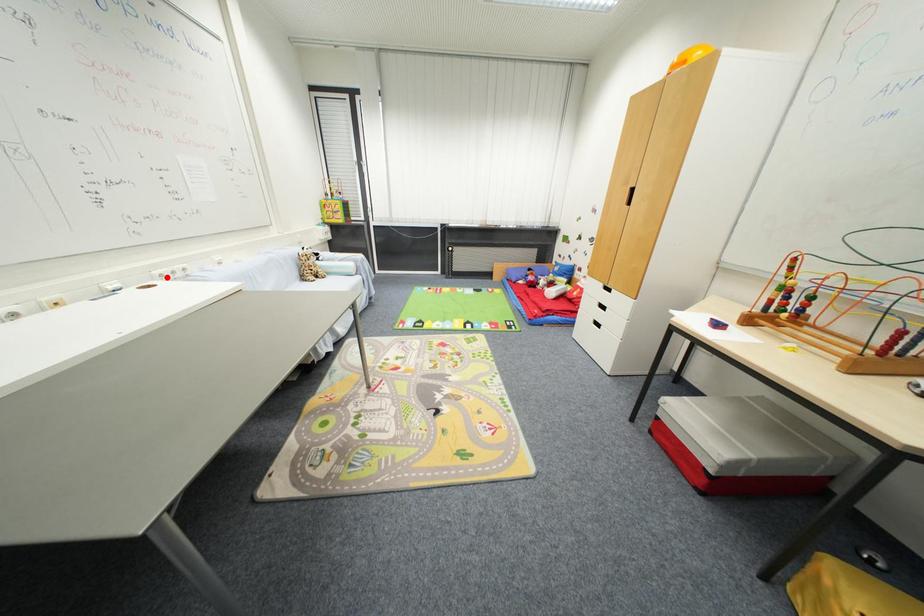
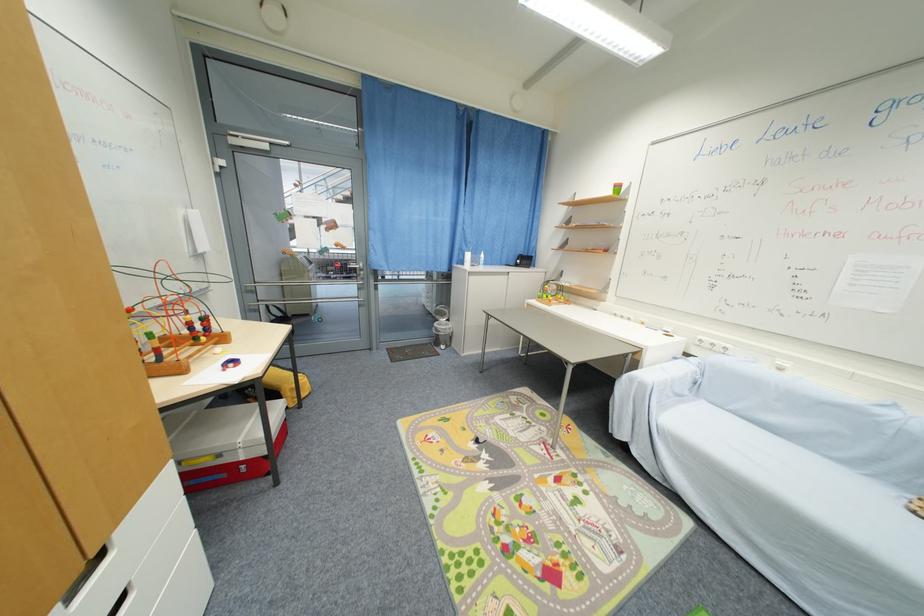
The point at the highlighted location is marked in the first image. Where is the corresponding point in the second image?

(706, 342)